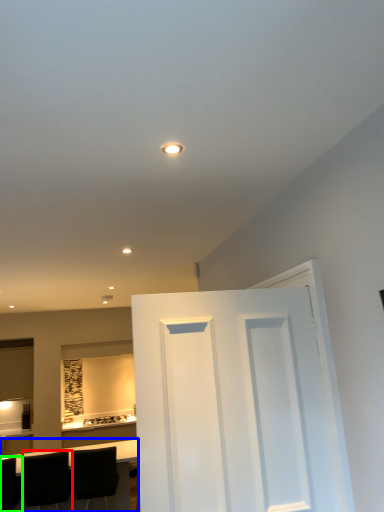
Question: Which object is the closest to the chair (highlighted by a red box)? Choose among these: table (highlighted by a blue box) or chair (highlighted by a green box).

Choices:
 (A) table
 (B) chair

Answer: (B)